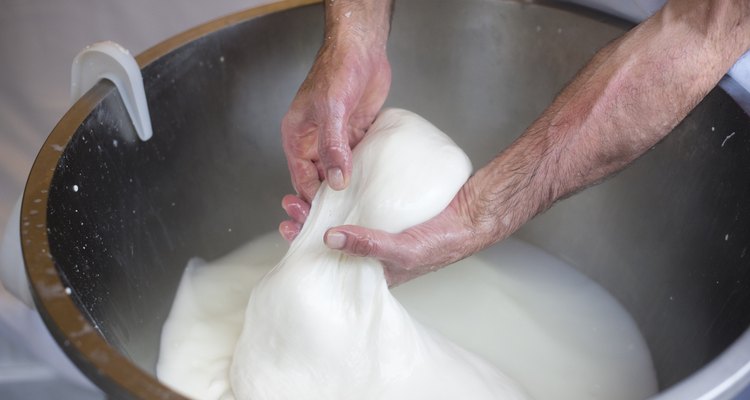
Locate an element on the screen. The image size is (750, 400). bowl is located at coordinates (169, 157).